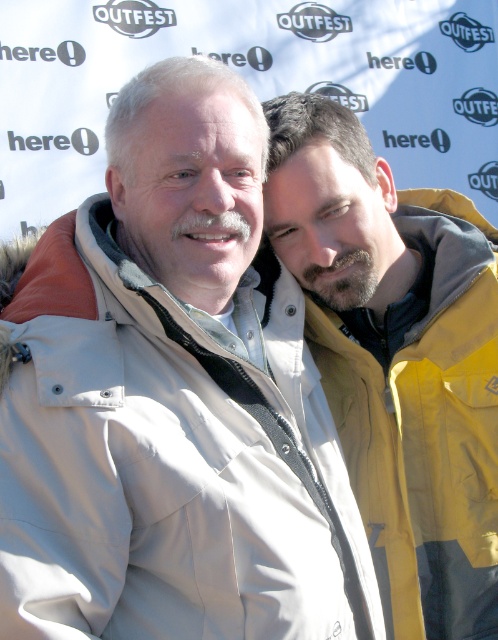
Question: Is beige fabric jacket at center bigger than yellow fabric jacket at right?

Choices:
 (A) no
 (B) yes

Answer: (B)

Question: Can you confirm if beige fabric jacket at center is positioned below yellow fabric jacket at right?

Choices:
 (A) yes
 (B) no

Answer: (A)

Question: Which point is farther to the camera?

Choices:
 (A) (414, 614)
 (B) (285, 352)

Answer: (B)

Question: Among these objects, which one is nearest to the camera?

Choices:
 (A) yellow fabric jacket at right
 (B) beige fabric jacket at center

Answer: (B)

Question: Is beige fabric jacket at center closer to camera compared to yellow fabric jacket at right?

Choices:
 (A) no
 (B) yes

Answer: (B)

Question: Which object appears farthest from the camera in this image?

Choices:
 (A) yellow fabric jacket at right
 (B) beige fabric jacket at center

Answer: (A)